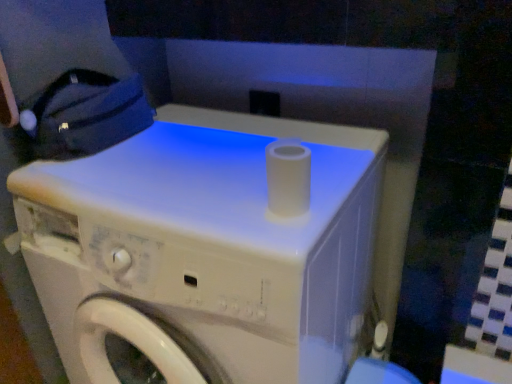
Find the location of a particular element. white matte washing machine at center is located at coordinates (207, 248).

The image size is (512, 384). What do you see at coordinates (207, 248) in the screenshot? I see `white matte washing machine at center` at bounding box center [207, 248].

Identify the location of white matte washing machine at center. The image size is (512, 384). (207, 248).